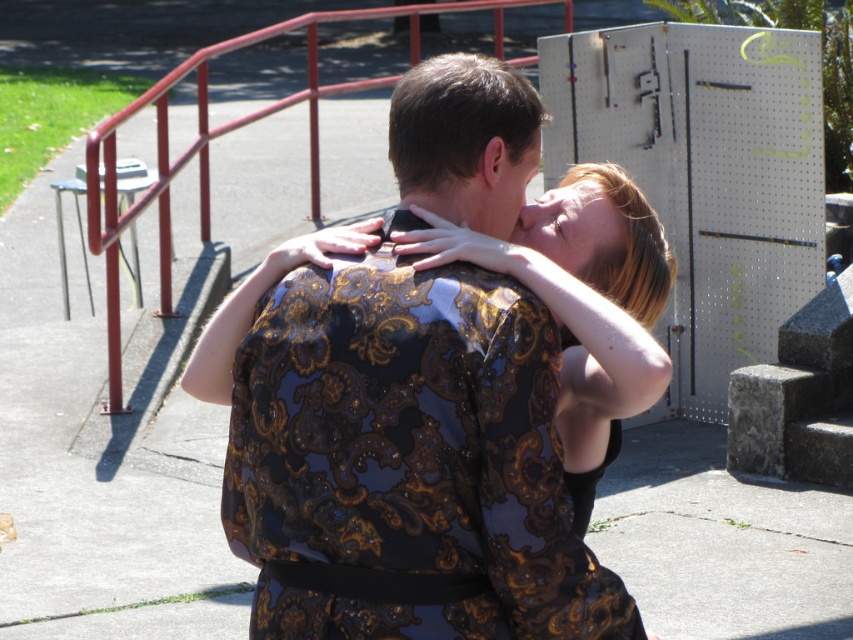
Consider the image. Is glossy floral-patterned dress at center taller than metallic red railing at left?

Incorrect, glossy floral-patterned dress at center's height is not larger of metallic red railing at left's.

Can you confirm if glossy floral-patterned dress at center is smaller than metallic red railing at left?

Yes.

Does point (363, 404) come farther from viewer compared to point (91, 224)?

That is False.

The width and height of the screenshot is (853, 640). In order to click on glossy floral-patterned dress at center in this screenshot , I will do `click(407, 461)`.